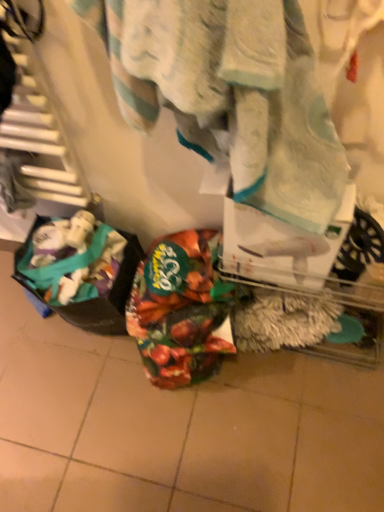
Find the location of `shiny metallic bag at center, the first waste viewed from the right`. shiny metallic bag at center, the first waste viewed from the right is located at coordinates (179, 309).

Describe the element at coordinates (231, 94) in the screenshot. I see `white textured towel at center` at that location.

Locate an element on the screen. shiny metallic bag at center, the first waste viewed from the right is located at coordinates (179, 309).

Looking at this image, from the image's perspective, between shiny metallic bag at center, the first waste viewed from the right, and plastic bag at lower left, marked as the first waste in a left-to-right arrangement, who is located below?

shiny metallic bag at center, the first waste viewed from the right.

Considering the sizes of objects shiny metallic bag at center, the first waste viewed from the right, and plastic bag at lower left, marked as the first waste in a left-to-right arrangement, in the image provided, who is shorter, shiny metallic bag at center, the first waste viewed from the right, or plastic bag at lower left, marked as the first waste in a left-to-right arrangement,?

With less height is shiny metallic bag at center, the first waste viewed from the right.

What's the angular difference between shiny metallic bag at center, the second waste viewed from the left, and plastic bag at lower left, marked as the first waste in a left-to-right arrangement,'s facing directions?

The angle between the facing direction of shiny metallic bag at center, the second waste viewed from the left, and the facing direction of plastic bag at lower left, marked as the first waste in a left-to-right arrangement, is 4.22e-05 degrees.

Find the location of `waste on the left of shiny metallic bag at center, the first waste viewed from the right`. waste on the left of shiny metallic bag at center, the first waste viewed from the right is located at coordinates click(x=83, y=277).

Choose the correct answer: Is white textured towel at center inside plastic bag at lower left, the 2th waste from the right, or outside it?

white textured towel at center is spatially situated outside plastic bag at lower left, the 2th waste from the right.

Does white textured towel at center come behind plastic bag at lower left, the 2th waste from the right?

No, it is in front of plastic bag at lower left, the 2th waste from the right.

From the image's perspective, is white textured towel at center located above or below plastic bag at lower left, the 2th waste from the right?

From the image's perspective, white textured towel at center appears above plastic bag at lower left, the 2th waste from the right.

From a real-world perspective, which object rests below the other?

plastic bag at lower left, the 2th waste from the right.

Looking at this image, is white textured towel at center in front of or behind shiny metallic bag at center, the first waste viewed from the right, in the image?

In the image, white textured towel at center appears in front of shiny metallic bag at center, the first waste viewed from the right.

How much distance is there between white textured towel at center and shiny metallic bag at center, the first waste viewed from the right?

white textured towel at center is 17.09 inches from shiny metallic bag at center, the first waste viewed from the right.

From a real-world perspective, which is physically above, white textured towel at center or shiny metallic bag at center, the first waste viewed from the right?

From a 3D spatial view, white textured towel at center is above.

Between white textured towel at center and shiny metallic bag at center, the first waste viewed from the right, which one appears on the right side from the viewer's perspective?

From the viewer's perspective, white textured towel at center appears more on the right side.

Consider the image. Is plastic bag at lower left, the 2th waste from the right, outside of white textured towel at center?

Yes, plastic bag at lower left, the 2th waste from the right, is located beyond the bounds of white textured towel at center.

Between plastic bag at lower left, marked as the first waste in a left-to-right arrangement, and white textured towel at center, which one is positioned in front?

white textured towel at center is in front.

Would you consider plastic bag at lower left, the 2th waste from the right, to be distant from white textured towel at center?

No, there isn't a large distance between plastic bag at lower left, the 2th waste from the right, and white textured towel at center.

Is plastic bag at lower left, the 2th waste from the right, oriented away from white textured towel at center?

plastic bag at lower left, the 2th waste from the right, is not turned away from white textured towel at center.

Is shiny metallic bag at center, the second waste viewed from the left, taller than white textured towel at center?

No, shiny metallic bag at center, the second waste viewed from the left, is not taller than white textured towel at center.

From the image's perspective, is shiny metallic bag at center, the first waste viewed from the right, on top of white textured towel at center?

Actually, shiny metallic bag at center, the first waste viewed from the right, appears below white textured towel at center in the image.

Between shiny metallic bag at center, the first waste viewed from the right, and white textured towel at center, which one has larger width?

Wider between the two is shiny metallic bag at center, the first waste viewed from the right.

From a real-world perspective, is shiny metallic bag at center, the second waste viewed from the left, positioned above or below white textured towel at center?

shiny metallic bag at center, the second waste viewed from the left, is situated lower than white textured towel at center in the real world.

Where is `waste on the left of shiny metallic bag at center, the second waste viewed from the left`? The image size is (384, 512). waste on the left of shiny metallic bag at center, the second waste viewed from the left is located at coordinates (83, 277).

Considering the sizes of plastic bag at lower left, the 2th waste from the right, and shiny metallic bag at center, the first waste viewed from the right, in the image, is plastic bag at lower left, the 2th waste from the right, wider or thinner than shiny metallic bag at center, the first waste viewed from the right,?

Considering their sizes, plastic bag at lower left, the 2th waste from the right, looks slimmer than shiny metallic bag at center, the first waste viewed from the right.

How far apart are plastic bag at lower left, marked as the first waste in a left-to-right arrangement, and shiny metallic bag at center, the second waste viewed from the left?

plastic bag at lower left, marked as the first waste in a left-to-right arrangement, and shiny metallic bag at center, the second waste viewed from the left, are 16.95 centimeters apart from each other.

From the image's perspective, who appears lower, plastic bag at lower left, the 2th waste from the right, or shiny metallic bag at center, the second waste viewed from the left?

From the image's view, shiny metallic bag at center, the second waste viewed from the left, is below.

This screenshot has height=512, width=384. Identify the location of waste below the shiny metallic bag at center, the second waste viewed from the left (from a real-world perspective). (83, 277).

Locate an element on the screen. The height and width of the screenshot is (512, 384). the 1st waste behind the white textured towel at center, starting your count from the anchor is located at coordinates (83, 277).

Estimate the real-world distances between objects in this image. Which object is closer to shiny metallic bag at center, the second waste viewed from the left, plastic bag at lower left, marked as the first waste in a left-to-right arrangement, or white textured towel at center?

plastic bag at lower left, marked as the first waste in a left-to-right arrangement, is positioned closer to the anchor shiny metallic bag at center, the second waste viewed from the left.

From the image, which object appears to be nearer to plastic bag at lower left, the 2th waste from the right, shiny metallic bag at center, the first waste viewed from the right, or white textured towel at center?

The object closer to plastic bag at lower left, the 2th waste from the right, is shiny metallic bag at center, the first waste viewed from the right.

Which object lies nearer to the anchor point shiny metallic bag at center, the first waste viewed from the right, white textured towel at center or plastic bag at lower left, marked as the first waste in a left-to-right arrangement?

Among the two, plastic bag at lower left, marked as the first waste in a left-to-right arrangement, is located nearer to shiny metallic bag at center, the first waste viewed from the right.

Looking at the image, which one is located further to white textured towel at center, plastic bag at lower left, the 2th waste from the right, or shiny metallic bag at center, the second waste viewed from the left?

The object further to white textured towel at center is plastic bag at lower left, the 2th waste from the right.

Which object lies further to the anchor point white textured towel at center, shiny metallic bag at center, the first waste viewed from the right, or plastic bag at lower left, marked as the first waste in a left-to-right arrangement?

plastic bag at lower left, marked as the first waste in a left-to-right arrangement, is positioned further to the anchor white textured towel at center.

From the picture: Estimate the real-world distances between objects in this image. Which object is further from plastic bag at lower left, marked as the first waste in a left-to-right arrangement, white textured towel at center or shiny metallic bag at center, the first waste viewed from the right?

white textured towel at center lies further to plastic bag at lower left, marked as the first waste in a left-to-right arrangement, than the other object.

Find the location of `waste between white textured towel at center and shiny metallic bag at center, the second waste viewed from the left, along the z-axis`. waste between white textured towel at center and shiny metallic bag at center, the second waste viewed from the left, along the z-axis is located at coordinates (83, 277).